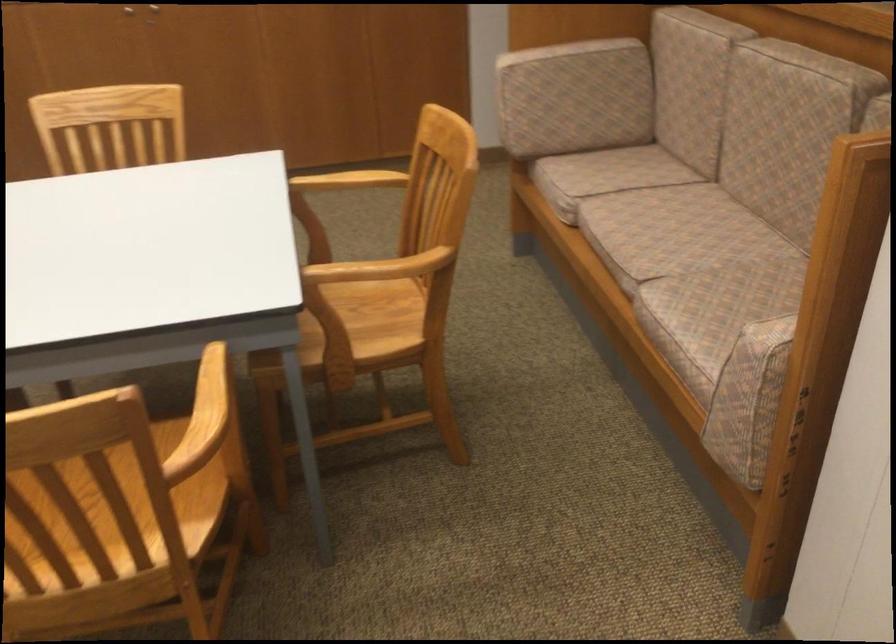
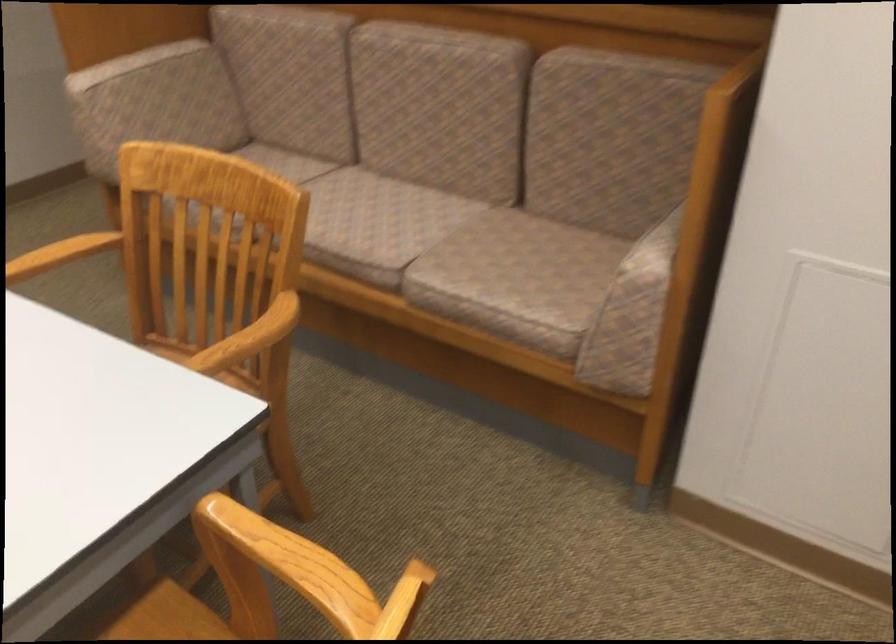
In the second image, find the point that corresponds to (662,234) in the first image.

(378, 223)